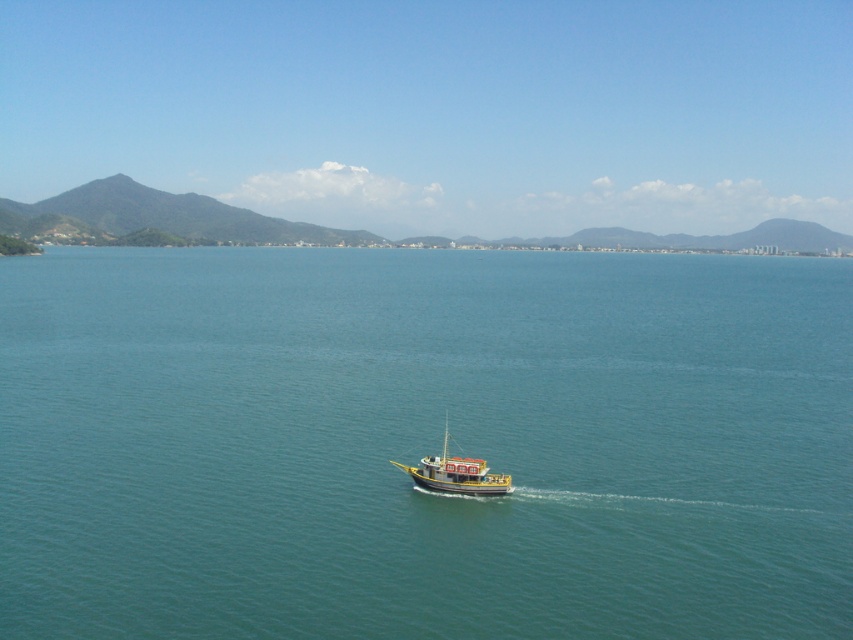
Question: Is teal smooth water at center bigger than wooden boat at center?

Choices:
 (A) yes
 (B) no

Answer: (A)

Question: Is teal smooth water at center to the left of wooden boat at center from the viewer's perspective?

Choices:
 (A) no
 (B) yes

Answer: (A)

Question: Which point appears farthest from the camera in this image?

Choices:
 (A) (426, 308)
 (B) (454, 474)

Answer: (A)

Question: Does teal smooth water at center have a lesser width compared to wooden boat at center?

Choices:
 (A) yes
 (B) no

Answer: (B)

Question: Among these points, which one is farthest from the camera?

Choices:
 (A) (450, 529)
 (B) (486, 474)

Answer: (B)